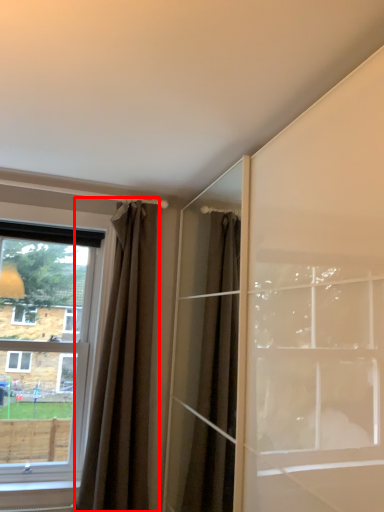
Question: Where is curtain (annotated by the red box) located in relation to window in the image?

Choices:
 (A) left
 (B) right

Answer: (B)